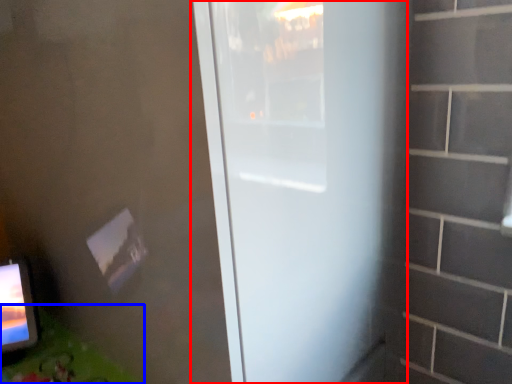
Question: Which of the following is the farthest to the observer, door (highlighted by a red box) or table (highlighted by a blue box)?

Choices:
 (A) door
 (B) table

Answer: (B)